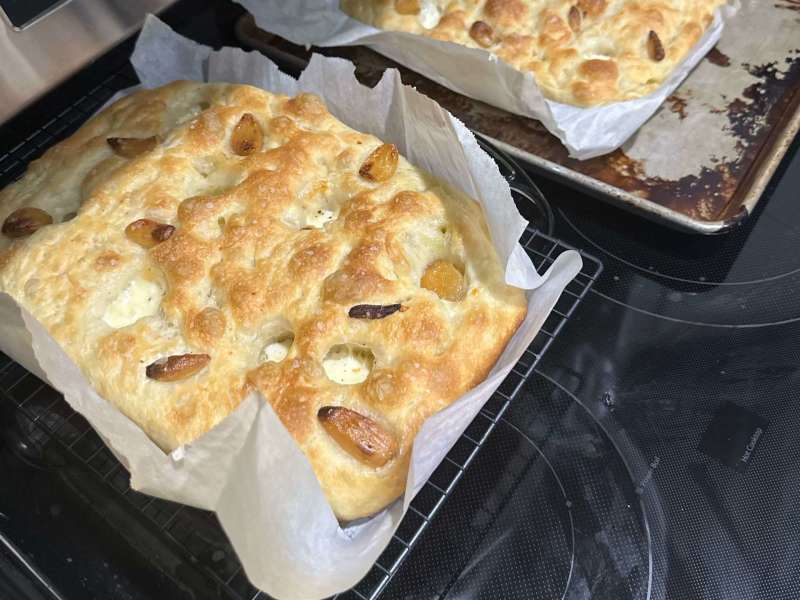
Where is `metal baking sheet pan`? This screenshot has width=800, height=600. metal baking sheet pan is located at coordinates (674, 135).